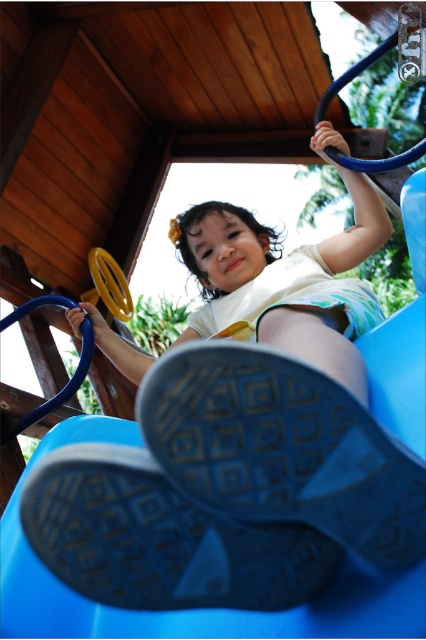
Question: Which of the following is the closest to the observer?

Choices:
 (A) smooth white shirt at center
 (B) matte blue slide at lower center

Answer: (B)

Question: Can you confirm if matte blue slide at lower center is wider than smooth white shirt at center?

Choices:
 (A) no
 (B) yes

Answer: (A)

Question: Which object appears closest to the camera in this image?

Choices:
 (A) matte blue slide at lower center
 (B) smooth white shirt at center

Answer: (A)

Question: Is matte blue slide at lower center closer to camera compared to smooth white shirt at center?

Choices:
 (A) yes
 (B) no

Answer: (A)

Question: From the image, what is the correct spatial relationship of matte blue slide at lower center in relation to smooth white shirt at center?

Choices:
 (A) above
 (B) below

Answer: (B)